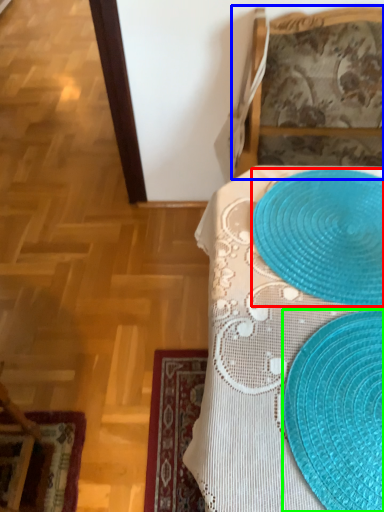
Question: Which is nearer to the platter (highlighted by a red box)? furniture (highlighted by a blue box) or straw hat (highlighted by a green box).

Choices:
 (A) furniture
 (B) straw hat

Answer: (B)